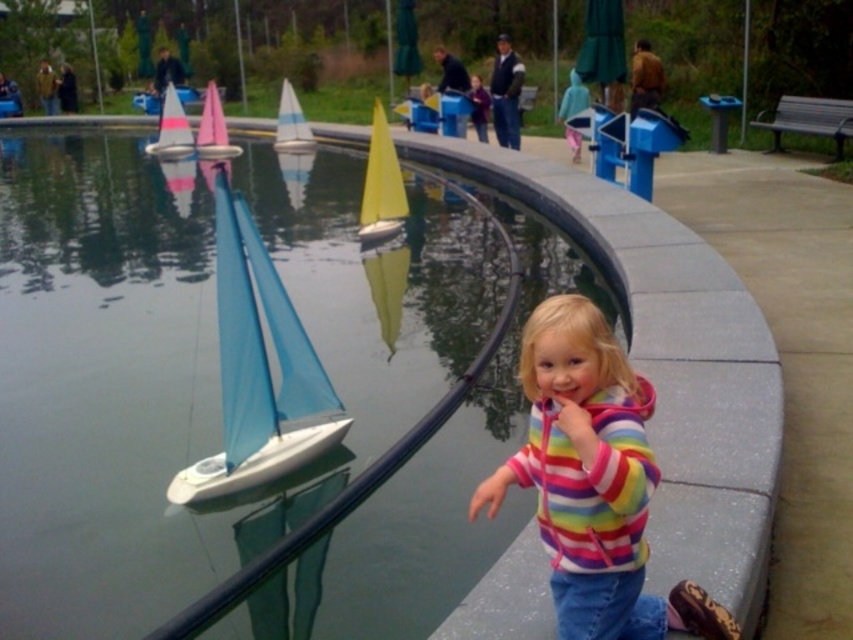
Is yellow matte sailboat at center bigger than blue matte sailboat at center?

Yes.

Can you confirm if yellow matte sailboat at center is taller than blue matte sailboat at center?

Yes.

Between point (363, 202) and point (305, 141), which one is positioned in front?

Point (363, 202)

The height and width of the screenshot is (640, 853). Identify the location of yellow matte sailboat at center. (381, 184).

From the picture: Which of these two, transparent plastic pool at center or blue fabric sailboat at left, stands taller?

transparent plastic pool at center is taller.

Is point (144, 353) closer to camera compared to point (274, 477)?

No.

Where is `transparent plastic pool at center`? Image resolution: width=853 pixels, height=640 pixels. transparent plastic pool at center is located at coordinates (190, 360).

Can you confirm if transparent plastic pool at center is smaller than blue matte sailboat at center?

No.

Is transparent plastic pool at center to the left of blue matte sailboat at center from the viewer's perspective?

Indeed, transparent plastic pool at center is positioned on the left side of blue matte sailboat at center.

Which is in front, point (15, 180) or point (283, 132)?

Point (15, 180) is in front.

Where is `transparent plastic pool at center`? This screenshot has width=853, height=640. transparent plastic pool at center is located at coordinates (190, 360).